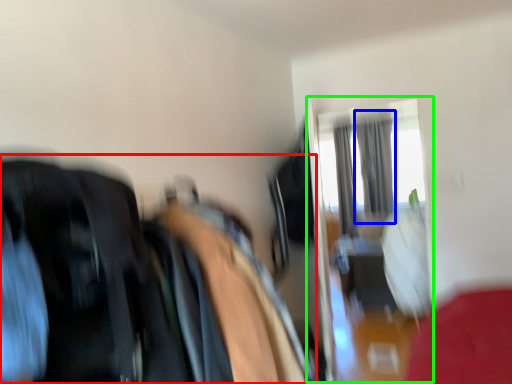
Question: Estimate the real-world distances between objects in this image. Which object is closer to laundry (highlighted by a red box), curtain (highlighted by a blue box) or glass door (highlighted by a green box)?

Choices:
 (A) curtain
 (B) glass door

Answer: (B)